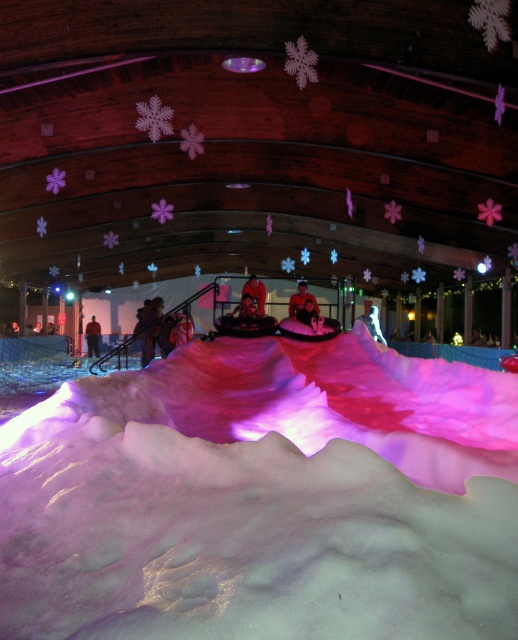
Find the location of a particular element. white fluffy snow at center is located at coordinates (264, 497).

Who is more forward, (296, 538) or (244, 294)?

Point (296, 538) is more forward.

The width and height of the screenshot is (518, 640). Identify the location of white fluffy snow at center. (264, 497).

Describe the element at coordinates (254, 292) in the screenshot. The height and width of the screenshot is (640, 518). I see `red fabric jacket at center` at that location.

Is red fabric jacket at center positioned in front of red fabric jacket at lower left?

Yes.

Is point (260, 296) farther from viewer compared to point (88, 339)?

No, (260, 296) is closer to viewer.

I want to click on red fabric jacket at center, so click(254, 292).

Between white fluffy snow at center and red fabric jacket at lower left, which one has more height?

red fabric jacket at lower left

Which is above, white fluffy snow at center or red fabric jacket at lower left?

Positioned higher is red fabric jacket at lower left.

Who is more forward, (463, 566) or (91, 321)?

Positioned in front is point (463, 566).

Where is `white fluffy snow at center`? white fluffy snow at center is located at coordinates (264, 497).